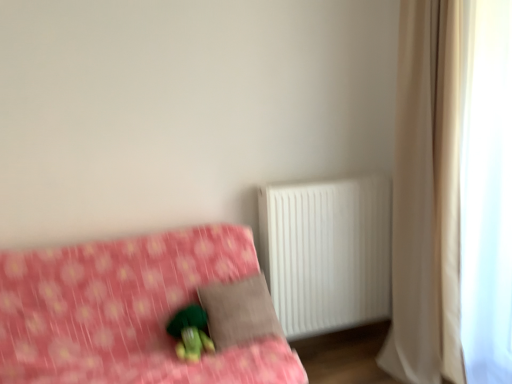
Question: From a real-world perspective, is pink fabric bed at lower left on beige fabric curtain at right?

Choices:
 (A) yes
 (B) no

Answer: (B)

Question: From the image's perspective, is pink fabric bed at lower left below beige fabric curtain at right?

Choices:
 (A) yes
 (B) no

Answer: (A)

Question: Is the surface of pink fabric bed at lower left in direct contact with beige fabric curtain at right?

Choices:
 (A) no
 (B) yes

Answer: (A)

Question: Is pink fabric bed at lower left bigger than beige fabric curtain at right?

Choices:
 (A) yes
 (B) no

Answer: (A)

Question: Does pink fabric bed at lower left appear on the left side of beige fabric curtain at right?

Choices:
 (A) yes
 (B) no

Answer: (A)

Question: Considering the positions of white plastic radiator at right and beige fabric curtain at right in the image, is white plastic radiator at right bigger or smaller than beige fabric curtain at right?

Choices:
 (A) small
 (B) big

Answer: (A)

Question: Is white plastic radiator at right inside or outside of beige fabric curtain at right?

Choices:
 (A) outside
 (B) inside

Answer: (A)

Question: Considering the positions of white plastic radiator at right and beige fabric curtain at right in the image, is white plastic radiator at right wider or thinner than beige fabric curtain at right?

Choices:
 (A) wide
 (B) thin

Answer: (B)

Question: From the image's perspective, is white plastic radiator at right above or below beige fabric curtain at right?

Choices:
 (A) above
 (B) below

Answer: (B)

Question: Is white sheer curtain at right in front of or behind brown fabric pillow at center in the image?

Choices:
 (A) front
 (B) behind

Answer: (A)

Question: Looking at the image, does white sheer curtain at right seem bigger or smaller compared to brown fabric pillow at center?

Choices:
 (A) big
 (B) small

Answer: (A)

Question: Considering the relative positions of white sheer curtain at right and brown fabric pillow at center in the image provided, is white sheer curtain at right to the left or to the right of brown fabric pillow at center?

Choices:
 (A) left
 (B) right

Answer: (B)

Question: In terms of height, does white sheer curtain at right look taller or shorter compared to brown fabric pillow at center?

Choices:
 (A) short
 (B) tall

Answer: (B)

Question: In the image, is beige fabric curtain at right on the left side or the right side of pink fabric bed at lower left?

Choices:
 (A) right
 (B) left

Answer: (A)

Question: From the image's perspective, is beige fabric curtain at right positioned above or below pink fabric bed at lower left?

Choices:
 (A) below
 (B) above

Answer: (B)